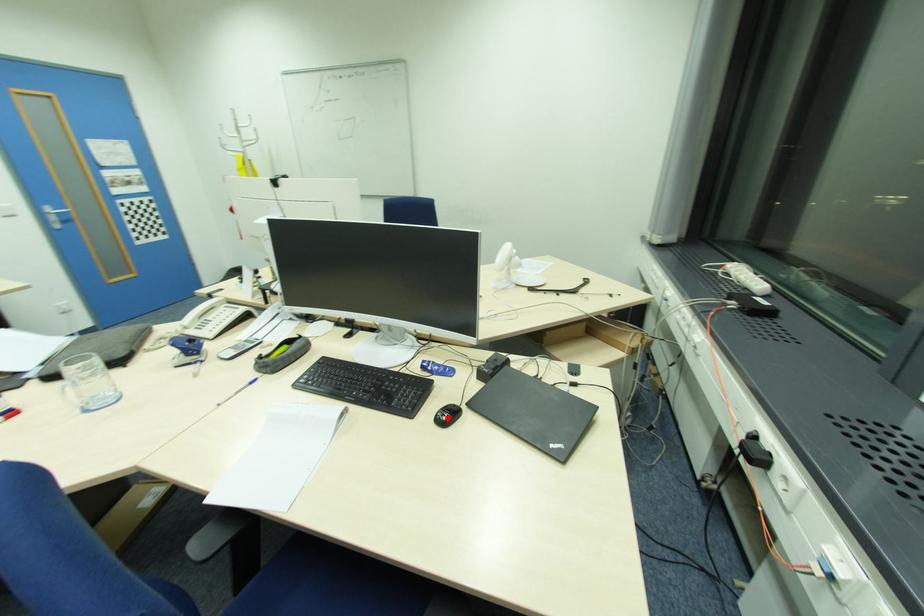
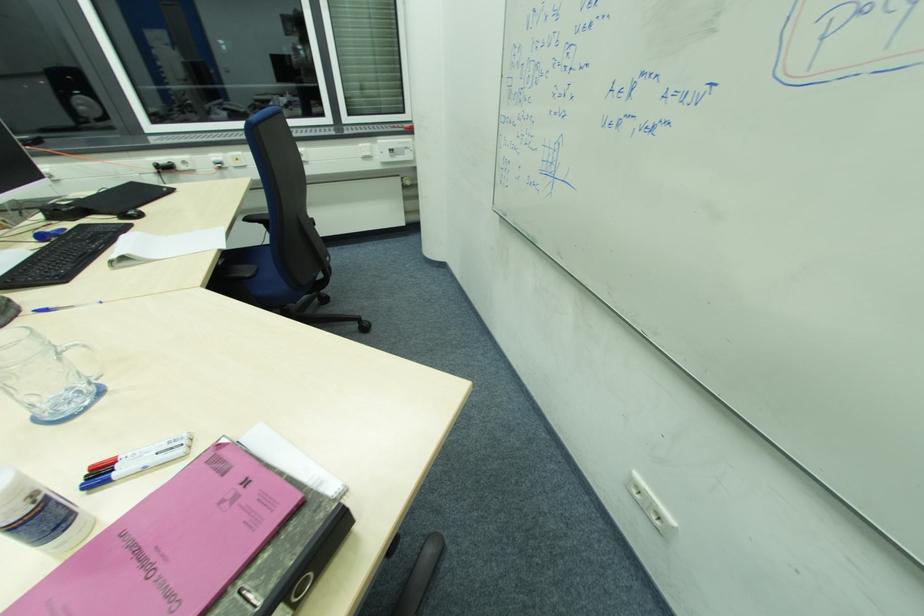
In the second image, find the point that corresponds to the highlighted location in the first image.

(140, 211)